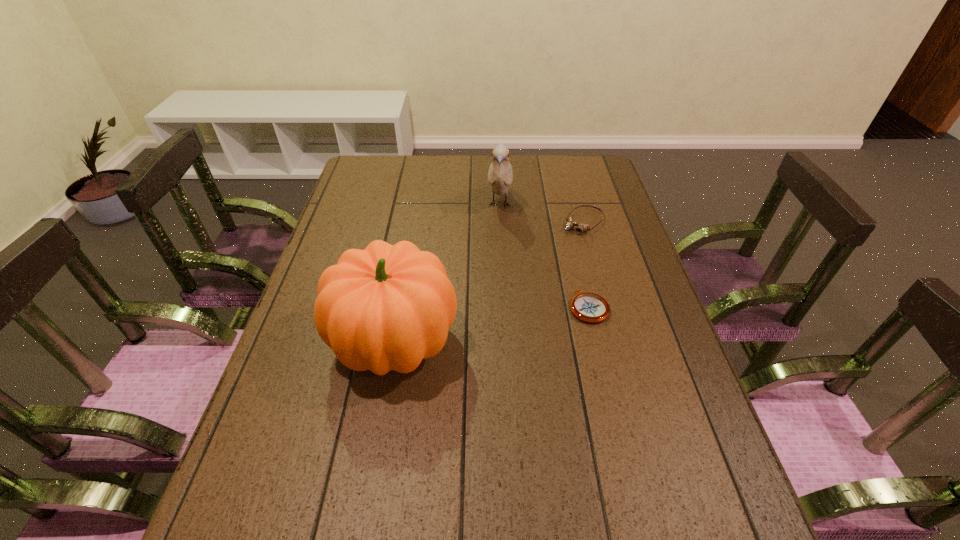
Locate an element on the screen. This screenshot has height=540, width=960. vacant space at the far right corner of the desktop is located at coordinates (572, 177).

This screenshot has width=960, height=540. I want to click on free area in between the leftmost object and the second object from left to right, so click(447, 274).

At what (x,y) coordinates should I click in order to perform the action: click on empty space that is in between the second shortest object and the pumpkin. Please return your answer as a coordinate pair (x, y). Image resolution: width=960 pixels, height=540 pixels. Looking at the image, I should click on (489, 282).

The image size is (960, 540). Find the location of `blank region between the goggles and the bird`. blank region between the goggles and the bird is located at coordinates (541, 213).

Find the location of a particular element. free space between the shortest object and the goggles is located at coordinates (586, 265).

Identify the location of vacant space that's between the compass and the bird. The height and width of the screenshot is (540, 960). click(544, 256).

This screenshot has width=960, height=540. Find the location of `free space between the bird and the shortest object`. free space between the bird and the shortest object is located at coordinates (544, 256).

At what (x,y) coordinates should I click in order to perform the action: click on free space between the pumpkin and the compass. Please return your answer as a coordinate pair (x, y). This screenshot has width=960, height=540. Looking at the image, I should click on (492, 325).

Identify the location of unoccupied position between the compass and the second shortest object. [x=586, y=265].

I want to click on free area in between the goggles and the bird, so click(541, 213).